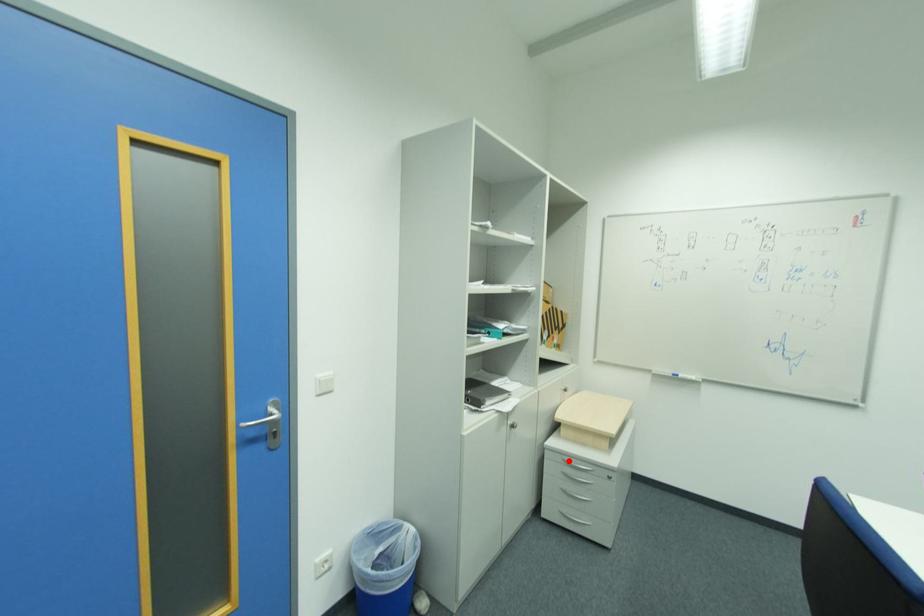
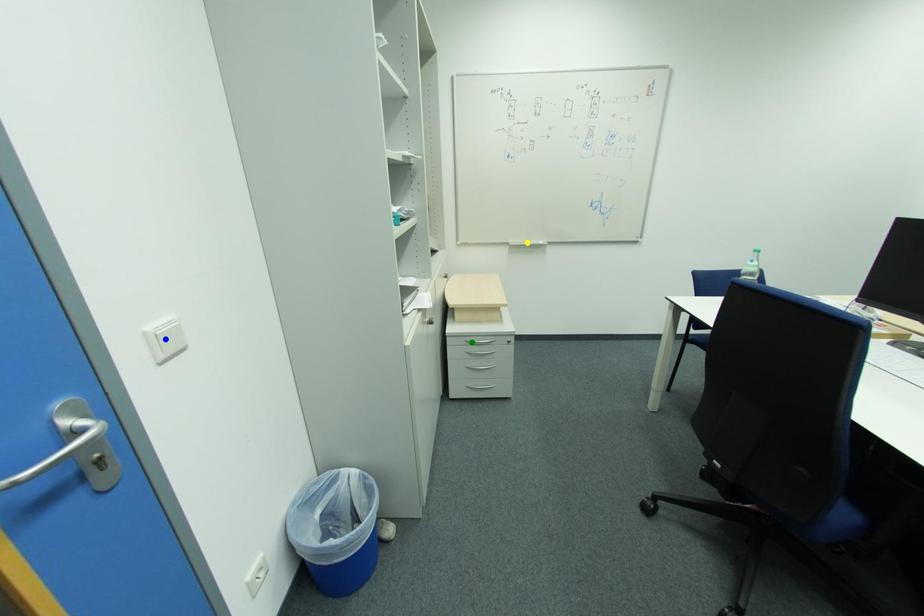
Question: I am providing you with two images of the same scene from different viewpoints. A red point is marked on the first image. You are given multiple points on the second image. Which point in image 2 represents the same 3d spot as the red point in image 1?

Choices:
 (A) green point
 (B) yellow point
 (C) blue point

Answer: (A)